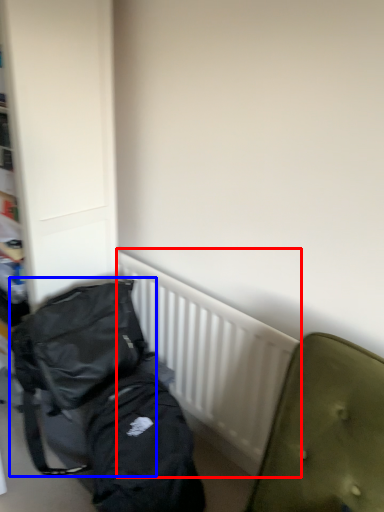
Question: Which point is closer to the camera, radiator (highlighted by a red box) or backpack (highlighted by a blue box)?

Choices:
 (A) radiator
 (B) backpack

Answer: (B)